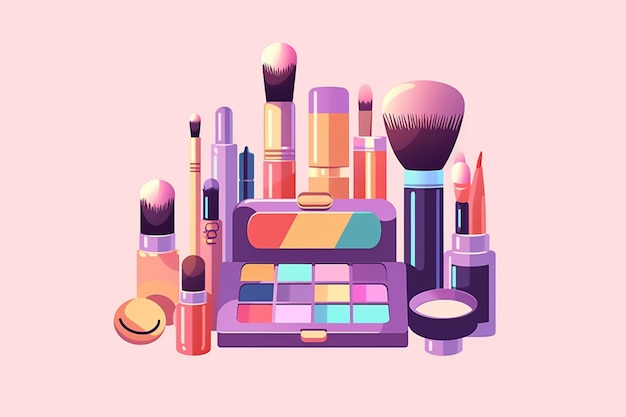
Where is `make up case`? make up case is located at coordinates (x=392, y=296), (x=233, y=291).